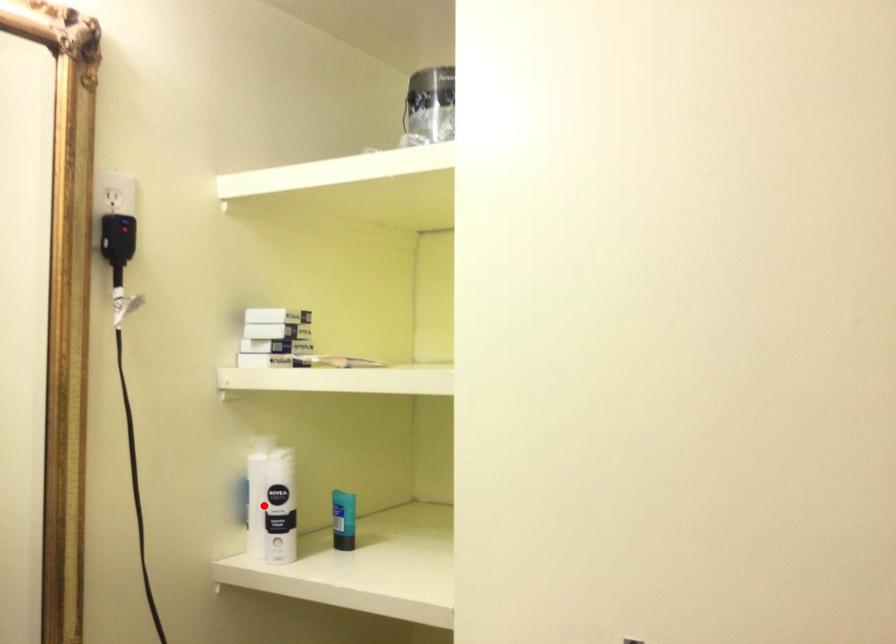
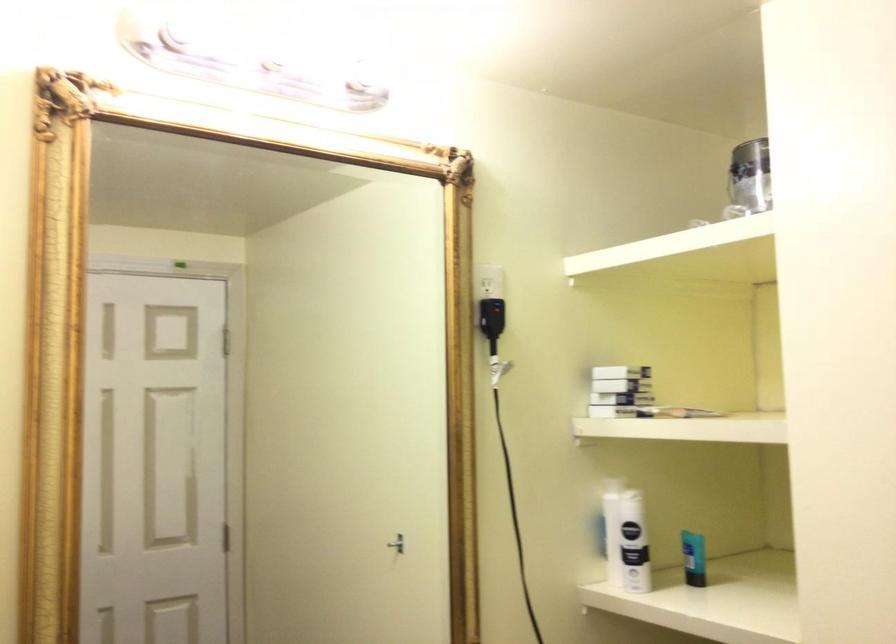
Question: A red point is marked in image1. In image2, is the corresponding 3D point closer to the camera or farther? Reply with the corresponding letter.

Choices:
 (A) The corresponding 3D point is closer.
 (B) The corresponding 3D point is farther.

Answer: (B)